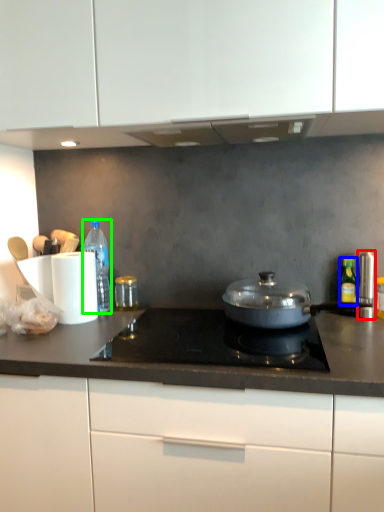
Question: Which object is the closest to the appliance (highlighted by a red box)? Choose among these: bottle (highlighted by a blue box) or bottle (highlighted by a green box).

Choices:
 (A) bottle
 (B) bottle

Answer: (A)